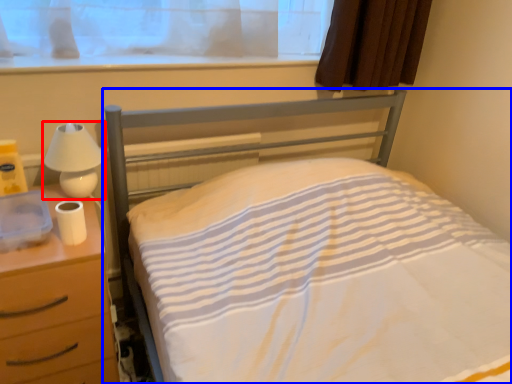
Question: Which object appears closest to the camera in this image, lamp (highlighted by a red box) or bed (highlighted by a blue box)?

Choices:
 (A) lamp
 (B) bed

Answer: (B)